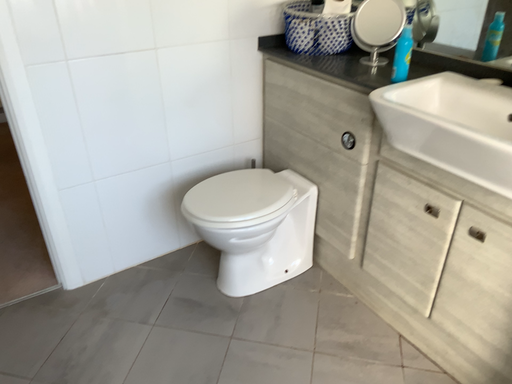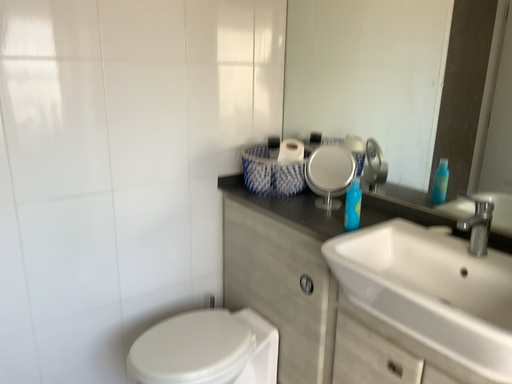
Question: Which way did the camera rotate in the video?

Choices:
 (A) rotated downward
 (B) rotated upward

Answer: (B)